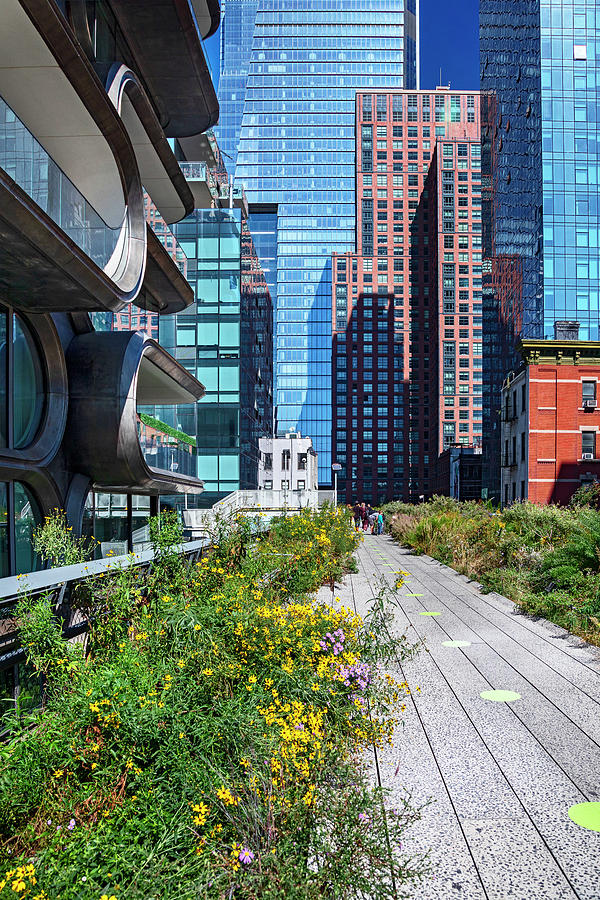
You are a GUI agent. You are given a task and a screenshot of the screen. Output one action in this format:
    pyautogui.click(x=<x>, y=<y>)
    Task: Click on the futuristic, pod shaped rooms
    
    Given the screenshot: What is the action you would take?
    [x=54, y=192], [x=138, y=410], [x=46, y=428]